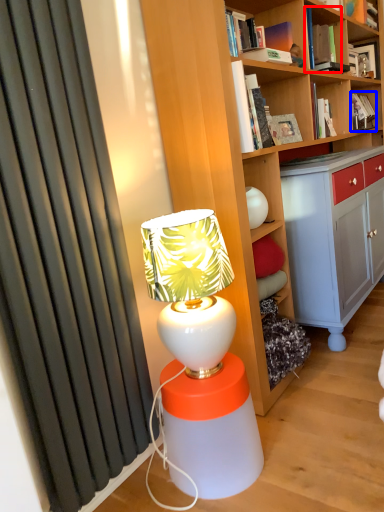
Question: Which of the following is the closest to the observer, book (highlighted by a red box) or book (highlighted by a blue box)?

Choices:
 (A) book
 (B) book

Answer: (A)